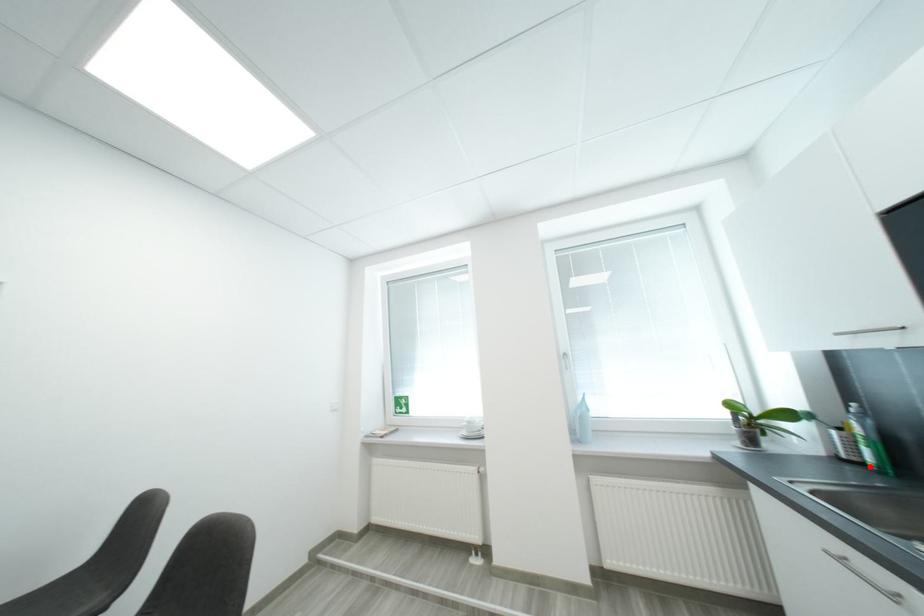
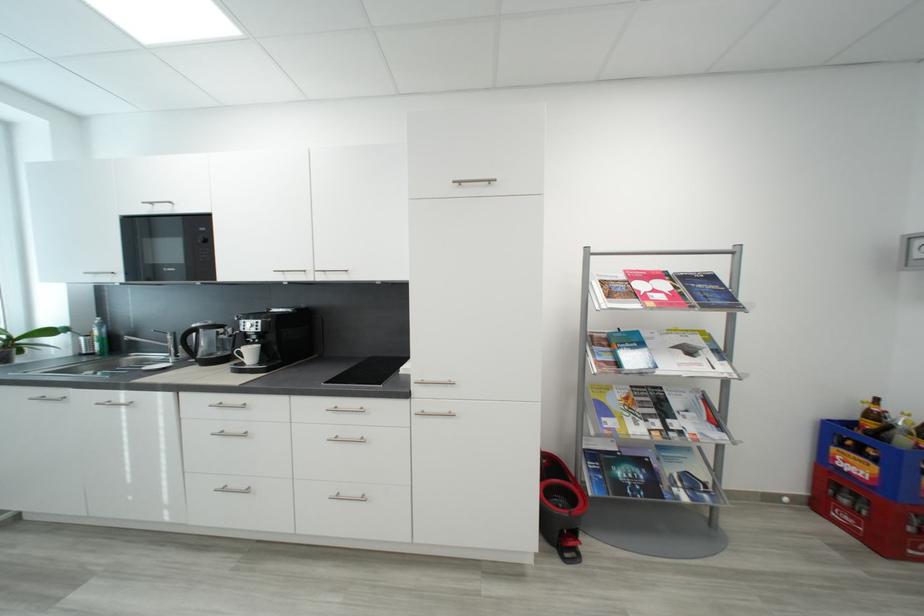
The point at the highlighted location is marked in the first image. Where is the corresponding point in the second image?

(100, 355)